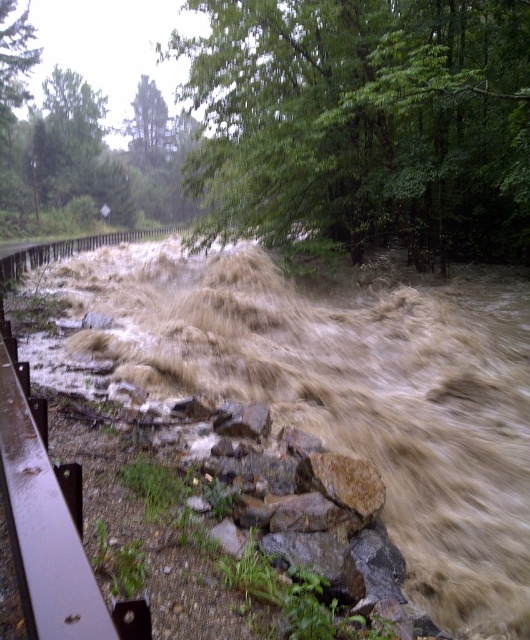
Which is more to the right, green leafy tree at upper center or rusty metal rail at lower left?

green leafy tree at upper center is more to the right.

The image size is (530, 640). Describe the element at coordinates (364, 122) in the screenshot. I see `green leafy tree at upper center` at that location.

You are a GUI agent. You are given a task and a screenshot of the screen. Output one action in this format:
    pyautogui.click(x=<x>, y=<y>)
    Task: Click on the green leafy tree at upper center
    This screenshot has width=530, height=640.
    Given the screenshot: What is the action you would take?
    click(364, 122)

Who is positioned more to the left, brown muddy water at center or rusty metal rail at lower left?

Positioned to the left is brown muddy water at center.

Does brown muddy water at center appear on the left side of rusty metal rail at lower left?

Indeed, brown muddy water at center is positioned on the left side of rusty metal rail at lower left.

Where is `brown muddy water at center`? The image size is (530, 640). brown muddy water at center is located at coordinates (341, 394).

Is point (323, 388) in front of point (525, 264)?

Yes, point (323, 388) is closer to viewer.

Is point (463, 547) positioned after point (418, 84)?

No.

Who is more distant from viewer, (70, 337) or (238, 180)?

The point (238, 180) is behind.

Where is `brown muddy water at center`? The height and width of the screenshot is (640, 530). brown muddy water at center is located at coordinates (341, 394).